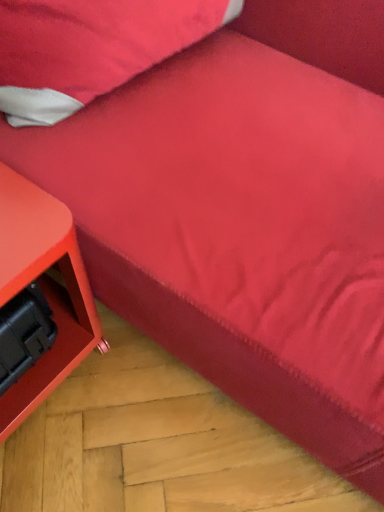
Measure the distance between matte orange side table at lower left and camera.

matte orange side table at lower left and camera are 23.14 inches apart from each other.

What do you see at coordinates (43, 289) in the screenshot? I see `matte orange side table at lower left` at bounding box center [43, 289].

The width and height of the screenshot is (384, 512). What are the coordinates of `matte orange side table at lower left` in the screenshot? It's located at (43, 289).

Identify the location of velvety red pillow at upper left. The width and height of the screenshot is (384, 512). (90, 48).

What do you see at coordinates (90, 48) in the screenshot? I see `velvety red pillow at upper left` at bounding box center [90, 48].

This screenshot has width=384, height=512. In order to click on matte orange side table at lower left in this screenshot , I will do `click(43, 289)`.

Between matte orange side table at lower left and velvety red pillow at upper left, which one appears on the left side from the viewer's perspective?

From the viewer's perspective, matte orange side table at lower left appears more on the left side.

Considering the relative positions of matte orange side table at lower left and velvety red pillow at upper left in the image provided, is matte orange side table at lower left behind velvety red pillow at upper left?

No, matte orange side table at lower left is closer to the viewer.

Considering the positions of points (10, 417) and (94, 49), is point (10, 417) closer to camera compared to point (94, 49)?

No, (10, 417) is behind (94, 49).

From the image's perspective, relative to velvety red pillow at upper left, is matte orange side table at lower left above or below?

Clearly, from the image's perspective, matte orange side table at lower left is below velvety red pillow at upper left.

From a real-world perspective, is matte orange side table at lower left over velvety red pillow at upper left?

No, from a real-world perspective, matte orange side table at lower left is not over velvety red pillow at upper left

Looking at their sizes, would you say matte orange side table at lower left is wider or thinner than velvety red pillow at upper left?

In the image, matte orange side table at lower left appears to be wider than velvety red pillow at upper left.

Can you confirm if matte orange side table at lower left is taller than velvety red pillow at upper left?

Yes, matte orange side table at lower left is taller than velvety red pillow at upper left.

Which of these two, matte orange side table at lower left or velvety red pillow at upper left, is bigger?

velvety red pillow at upper left.

Could velvety red pillow at upper left be considered to be inside matte orange side table at lower left?

No, velvety red pillow at upper left is not a part of matte orange side table at lower left.

Is matte orange side table at lower left beside velvety red pillow at upper left?

No, matte orange side table at lower left is not in contact with velvety red pillow at upper left.

Is matte orange side table at lower left turned away from velvety red pillow at upper left?

No, velvety red pillow at upper left is not at the back of matte orange side table at lower left.

Can you tell me how much matte orange side table at lower left and velvety red pillow at upper left differ in facing direction?

7.64 degrees.

Measure the distance from matte orange side table at lower left to velvety red pillow at upper left.

The distance of matte orange side table at lower left from velvety red pillow at upper left is 13.61 inches.

At what (x,y) coordinates should I click in order to perform the action: click on pillow behind the matte orange side table at lower left. Please return your answer as a coordinate pair (x, y). This screenshot has width=384, height=512. Looking at the image, I should click on (90, 48).

Between velvety red pillow at upper left and matte orange side table at lower left, which one appears on the left side from the viewer's perspective?

matte orange side table at lower left.

Which object is further away from the camera taking this photo, velvety red pillow at upper left or matte orange side table at lower left?

velvety red pillow at upper left is more distant.

Which is farther, (47,77) or (2,217)?

The point (47,77) is farther from the camera.

From the image's perspective, is velvety red pillow at upper left above or below matte orange side table at lower left?

From the image's perspective, velvety red pillow at upper left appears above matte orange side table at lower left.

From a real-world perspective, does velvety red pillow at upper left sit lower than matte orange side table at lower left?

No, from a real-world perspective, velvety red pillow at upper left is not beneath matte orange side table at lower left.

Which object is thinner, velvety red pillow at upper left or matte orange side table at lower left?

velvety red pillow at upper left is thinner.

Considering the relative sizes of velvety red pillow at upper left and matte orange side table at lower left in the image provided, is velvety red pillow at upper left taller than matte orange side table at lower left?

No.

Considering the relative sizes of velvety red pillow at upper left and matte orange side table at lower left in the image provided, is velvety red pillow at upper left bigger than matte orange side table at lower left?

Indeed, velvety red pillow at upper left has a larger size compared to matte orange side table at lower left.

Is velvety red pillow at upper left outside of matte orange side table at lower left?

Absolutely, velvety red pillow at upper left is external to matte orange side table at lower left.

Is velvety red pillow at upper left far away from matte orange side table at lower left?

No, there isn't a large distance between velvety red pillow at upper left and matte orange side table at lower left.

Is velvety red pillow at upper left looking in the opposite direction of matte orange side table at lower left?

No.

How different are the orientations of velvety red pillow at upper left and matte orange side table at lower left in degrees?

7.64 degrees.

Measure the distance from velvety red pillow at upper left to matte orange side table at lower left.

They are 13.61 inches apart.

The height and width of the screenshot is (512, 384). I want to click on pillow above the matte orange side table at lower left (from the image's perspective), so click(90, 48).

The width and height of the screenshot is (384, 512). In the image, there is a velvety red pillow at upper left. Find the location of `furniture below it (from a real-world perspective)`. furniture below it (from a real-world perspective) is located at coordinates (43, 289).

The image size is (384, 512). In order to click on furniture located in front of the velvety red pillow at upper left in this screenshot , I will do `click(43, 289)`.